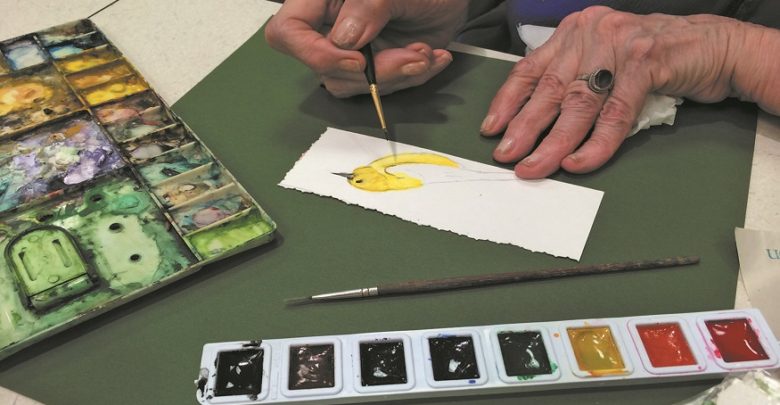
Where is `green paint`? green paint is located at coordinates (519, 352).